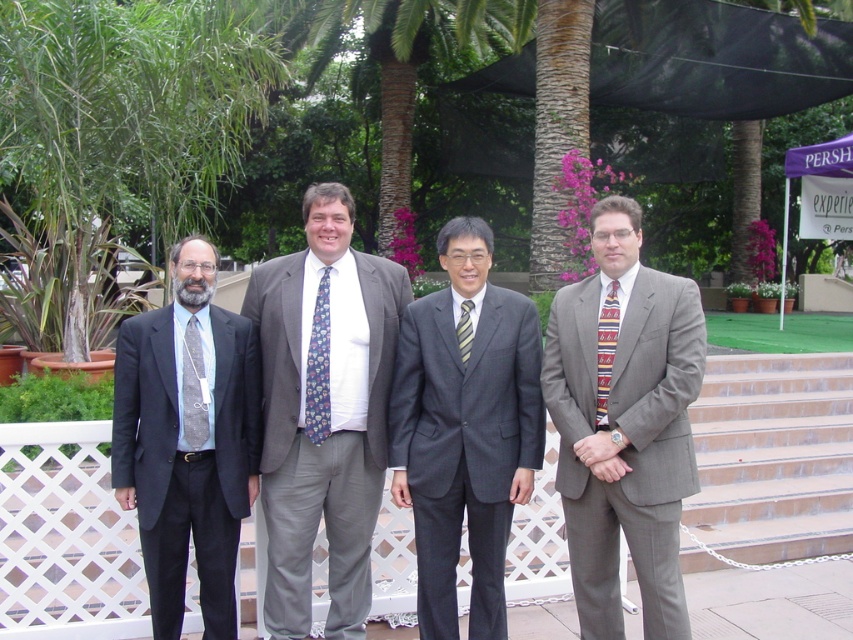
Which of these two, gray textured suit at center or striped fabric tie at center, stands shorter?

With less height is striped fabric tie at center.

Measure the distance between gray textured suit at center and striped fabric tie at center.

gray textured suit at center and striped fabric tie at center are 26.82 inches apart.

Between point (596, 294) and point (467, 337), which one is positioned in front?

Positioned in front is point (596, 294).

I want to click on gray textured suit at center, so click(x=624, y=422).

Consider the image. Is matte gray suit at left bigger than multicolored woven tie at right?

Yes.

Is matte gray suit at left thinner than multicolored woven tie at right?

No, matte gray suit at left is not thinner than multicolored woven tie at right.

Which is in front, point (158, 410) or point (606, 428)?

Point (606, 428)

Where is `matte gray suit at left`? This screenshot has width=853, height=640. matte gray suit at left is located at coordinates (187, 440).

What are the coordinates of `gray textured suit at center` in the screenshot? It's located at (624, 422).

Between gray textured suit at center and blue floral tie at center, which one appears on the left side from the viewer's perspective?

From the viewer's perspective, blue floral tie at center appears more on the left side.

Locate an element on the screen. Image resolution: width=853 pixels, height=640 pixels. gray textured suit at center is located at coordinates (624, 422).